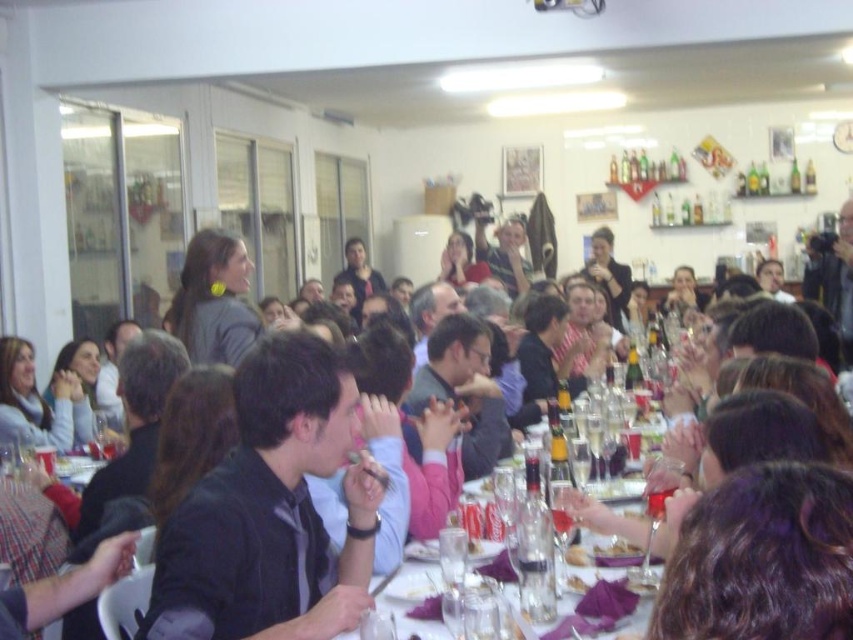
Who is higher up, dark gray shirt at center or smooth purple plate at center?

dark gray shirt at center

Between dark gray shirt at center and smooth purple plate at center, which one is positioned lower?

smooth purple plate at center is below.

Between point (347, 496) and point (621, 540), which one is positioned in front?

Point (347, 496) is more forward.

At what (x,y) coordinates should I click in order to perform the action: click on dark gray shirt at center. Please return your answer as a coordinate pair (x, y). The height and width of the screenshot is (640, 853). Looking at the image, I should click on (271, 509).

Based on the photo, which of these two, clear glass table at center or translucent glass wine at center, stands shorter?

translucent glass wine at center

Can you confirm if clear glass table at center is positioned to the right of translucent glass wine at center?

Indeed, clear glass table at center is positioned on the right side of translucent glass wine at center.

Does point (589, 500) lie in front of point (564, 556)?

That is False.

I want to click on clear glass table at center, so click(605, 518).

Who is higher up, matte gray jacket at upper center or smooth purple plate at center?

matte gray jacket at upper center is above.

Is point (599, 513) more distant than point (614, 548)?

No, (599, 513) is closer to viewer.

The width and height of the screenshot is (853, 640). Identify the location of matte gray jacket at upper center. tap(634, 520).